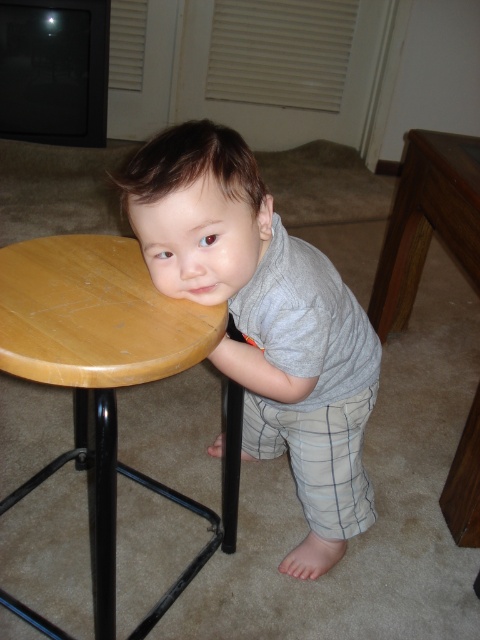
Between gray cotton shirt at center and wooden table at right, which one appears on the right side from the viewer's perspective?

From the viewer's perspective, wooden table at right appears more on the right side.

Can you confirm if gray cotton shirt at center is taller than wooden table at right?

Correct, gray cotton shirt at center is much taller as wooden table at right.

Between point (261, 326) and point (478, 225), which one is positioned in front?

Point (261, 326) is in front.

Image resolution: width=480 pixels, height=640 pixels. I want to click on gray cotton shirt at center, so click(264, 321).

Is wooden at left further to the viewer compared to wooden table at right?

No, it is not.

Image resolution: width=480 pixels, height=640 pixels. What do you see at coordinates (99, 371) in the screenshot?
I see `wooden at left` at bounding box center [99, 371].

Who is more distant from viewer, (108, 472) or (409, 163)?

Point (409, 163)

At what (x,y) coordinates should I click in order to perform the action: click on wooden at left. Please return your answer as a coordinate pair (x, y). This screenshot has width=480, height=640. Looking at the image, I should click on (99, 371).

Locate an element on the screen. wooden at left is located at coordinates (99, 371).

Is wooden at left below wooden round table at lower left?

Indeed, wooden at left is positioned under wooden round table at lower left.

Is point (208, 330) positioned after point (181, 337)?

Yes, it is behind point (181, 337).

This screenshot has width=480, height=640. Identify the location of wooden at left. (99, 371).